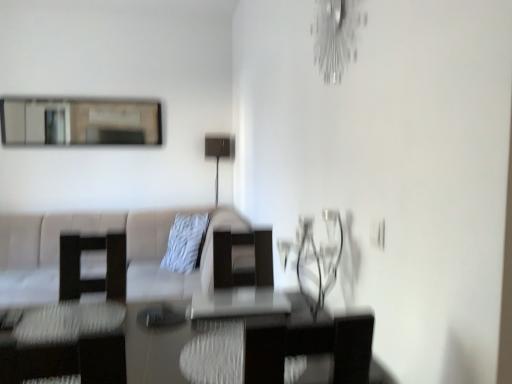
Question: Should I look upward or downward to see matte black lamp at center?

Choices:
 (A) up
 (B) down

Answer: (A)

Question: Does polished glass table at center appear on the right side of metallic silver light fixture at upper right?

Choices:
 (A) no
 (B) yes

Answer: (A)

Question: Is polished glass table at center thinner than metallic silver light fixture at upper right?

Choices:
 (A) no
 (B) yes

Answer: (A)

Question: Is polished glass table at center in front of metallic silver light fixture at upper right?

Choices:
 (A) no
 (B) yes

Answer: (B)

Question: Considering the relative positions of polished glass table at center and metallic silver light fixture at upper right in the image provided, is polished glass table at center to the left of metallic silver light fixture at upper right from the viewer's perspective?

Choices:
 (A) yes
 (B) no

Answer: (A)

Question: Is polished glass table at center facing towards metallic silver light fixture at upper right?

Choices:
 (A) yes
 (B) no

Answer: (B)

Question: Is polished glass table at center positioned with its back to metallic silver light fixture at upper right?

Choices:
 (A) no
 (B) yes

Answer: (A)

Question: Does matte black lamp at center turn towards matte black swivel chair at left?

Choices:
 (A) yes
 (B) no

Answer: (B)

Question: Does matte black lamp at center have a greater width compared to matte black swivel chair at left?

Choices:
 (A) yes
 (B) no

Answer: (B)

Question: Is matte black lamp at center not within matte black swivel chair at left?

Choices:
 (A) no
 (B) yes

Answer: (B)

Question: Considering the relative sizes of matte black lamp at center and matte black swivel chair at left in the image provided, is matte black lamp at center shorter than matte black swivel chair at left?

Choices:
 (A) yes
 (B) no

Answer: (B)

Question: Considering the relative positions of matte black lamp at center and matte black swivel chair at left in the image provided, is matte black lamp at center to the left of matte black swivel chair at left from the viewer's perspective?

Choices:
 (A) no
 (B) yes

Answer: (A)

Question: Is matte black lamp at center turned away from matte black swivel chair at left?

Choices:
 (A) no
 (B) yes

Answer: (A)

Question: Is transparent glass table at center positioned behind matte glass mirror at upper left?

Choices:
 (A) no
 (B) yes

Answer: (A)